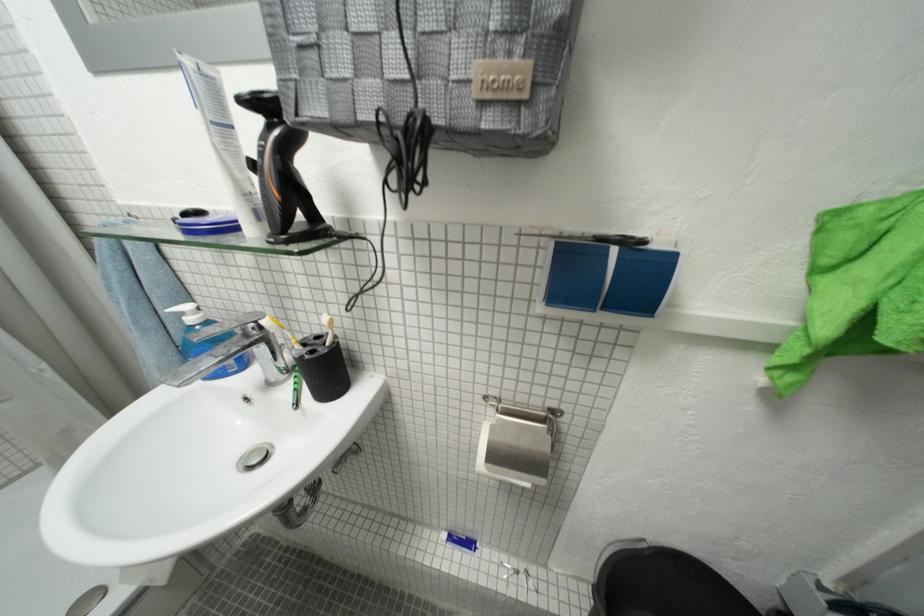
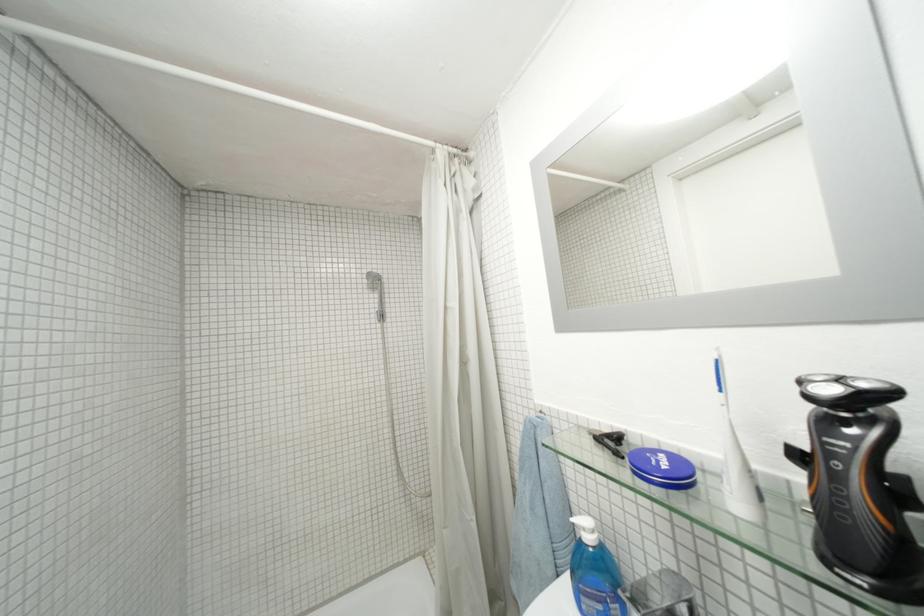
Locate, in the second image, the point that corresponds to point 53,368 in the first image.

(482, 521)